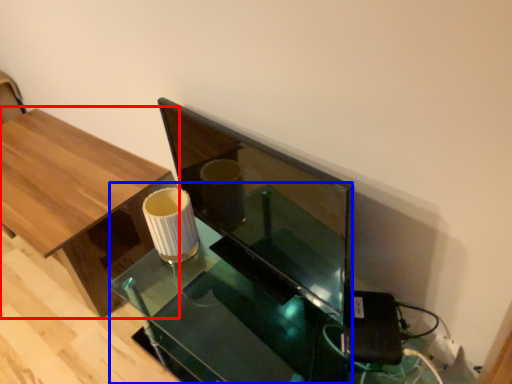
Question: Which object appears farthest to the camera in this image, table (highlighted by a red box) or round table (highlighted by a blue box)?

Choices:
 (A) table
 (B) round table

Answer: (A)